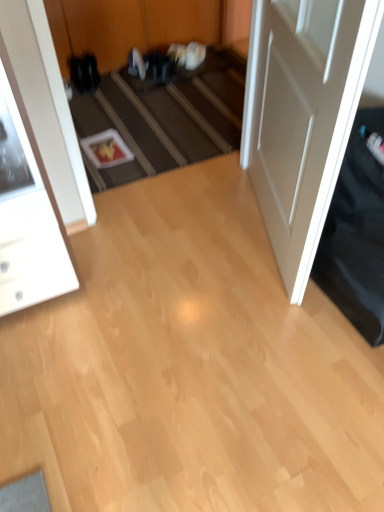
Question: From the image's perspective, is white glossy cabinet at left located above or below white matte door at right?

Choices:
 (A) below
 (B) above

Answer: (A)

Question: Based on their sizes in the image, would you say white glossy cabinet at left is bigger or smaller than white matte door at right?

Choices:
 (A) small
 (B) big

Answer: (A)

Question: Estimate the real-world distances between objects in this image. Which object is farther from the white matte door at right?

Choices:
 (A) carpeted stairs at center
 (B) white glossy cabinet at left

Answer: (B)

Question: Which is nearer to the white matte door at right?

Choices:
 (A) carpeted stairs at center
 (B) white glossy cabinet at left

Answer: (A)